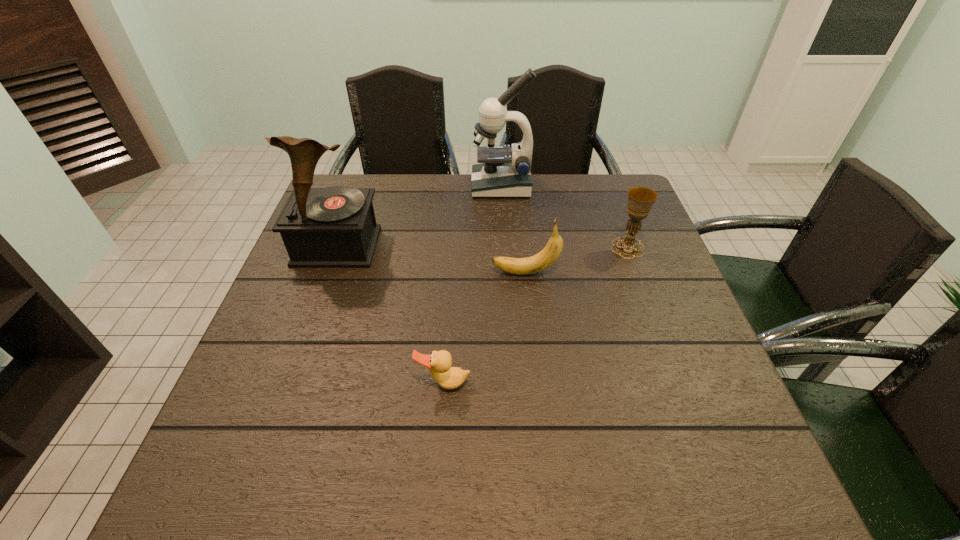
At what (x,y) coordinates should I click in order to perform the action: click on vacant region that satisfies the following two spatial constraints: 1. at the eyepiece of the microscope; 2. on the beak of the nearest object. Please return your answer as a coordinate pair (x, y). The height and width of the screenshot is (540, 960). Looking at the image, I should click on (514, 383).

Locate an element on the screen. The image size is (960, 540). vacant region that satisfies the following two spatial constraints: 1. at the eyepiece of the microscope; 2. at the horn opening of the phonograph_record is located at coordinates (505, 246).

Where is `vacant area that satisfies the following two spatial constraints: 1. at the eyepiece of the microscope; 2. at the horn opening of the leftmost object`? vacant area that satisfies the following two spatial constraints: 1. at the eyepiece of the microscope; 2. at the horn opening of the leftmost object is located at coordinates (505, 246).